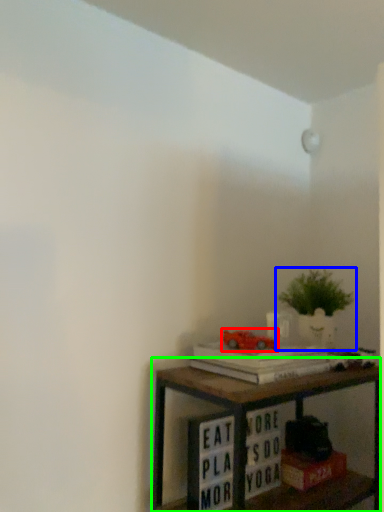
Question: Based on their relative distances, which object is farther from toy (highlighted by a red box)? Choose from houseplant (highlighted by a blue box) and shelf (highlighted by a green box).

Choices:
 (A) houseplant
 (B) shelf

Answer: (A)